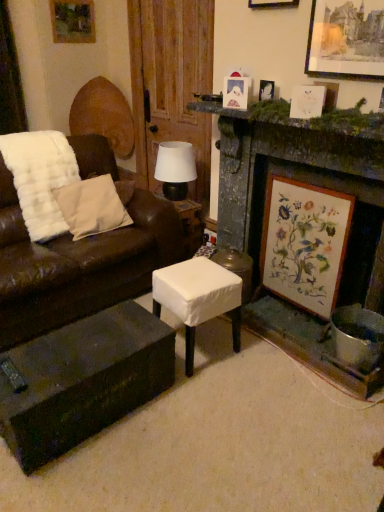
This screenshot has height=512, width=384. What are the coordinates of `vacant space in white fabric-covered stool at center (from a real-world perspective)` in the screenshot? It's located at (207, 350).